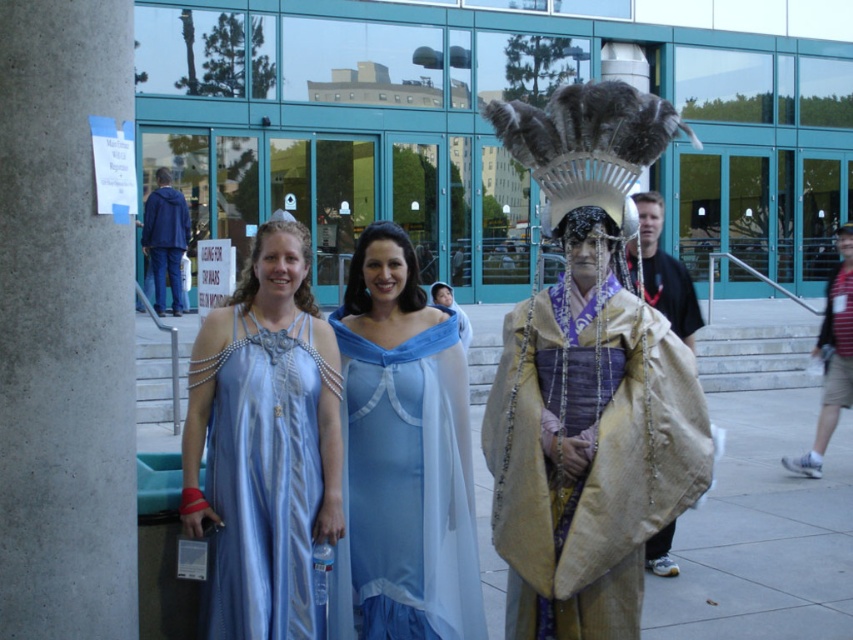
Is point (514, 538) positioned behind point (293, 449)?

Yes, point (514, 538) is farther from viewer.

Does gold textured cape at center lie behind satin blue dress at center?

Yes.

Which is in front, point (563, 483) or point (212, 435)?

Point (563, 483)

Locate an element on the screen. The image size is (853, 640). gold textured cape at center is located at coordinates (589, 380).

Between point (302, 417) and point (670, 308), which one is positioned in front?

Point (302, 417)

Is satin blue dress at center shorter than beige fabric cape at center?

No, satin blue dress at center is not shorter than beige fabric cape at center.

Identify the location of satin blue dress at center. The image size is (853, 640). (268, 476).

Between satin blue dress at center and striped t-shirt at right, which one appears on the right side from the viewer's perspective?

Positioned to the right is striped t-shirt at right.

Is satin blue dress at center shorter than striped t-shirt at right?

Indeed, satin blue dress at center has a lesser height compared to striped t-shirt at right.

Between point (265, 476) and point (840, 320), which one is positioned in front?

Point (265, 476)

What are the coordinates of `satin blue dress at center` in the screenshot? It's located at (268, 476).